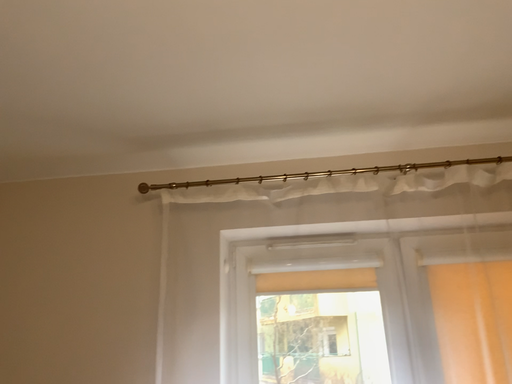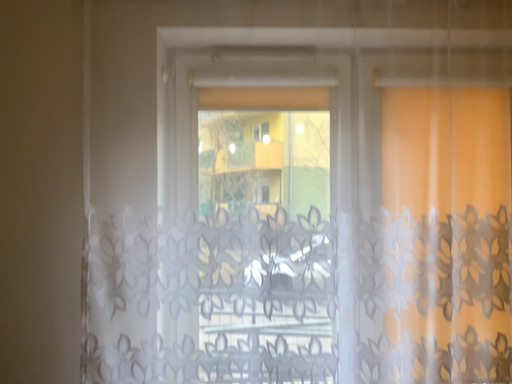
Question: How did the camera likely rotate when shooting the video?

Choices:
 (A) rotated left
 (B) rotated right

Answer: (B)